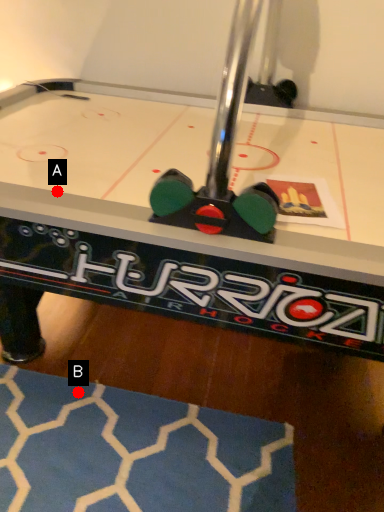
Question: Two points are circled on the image, labeled by A and B beside each circle. Which point is closer to the camera taking this photo?

Choices:
 (A) A is closer
 (B) B is closer

Answer: (A)